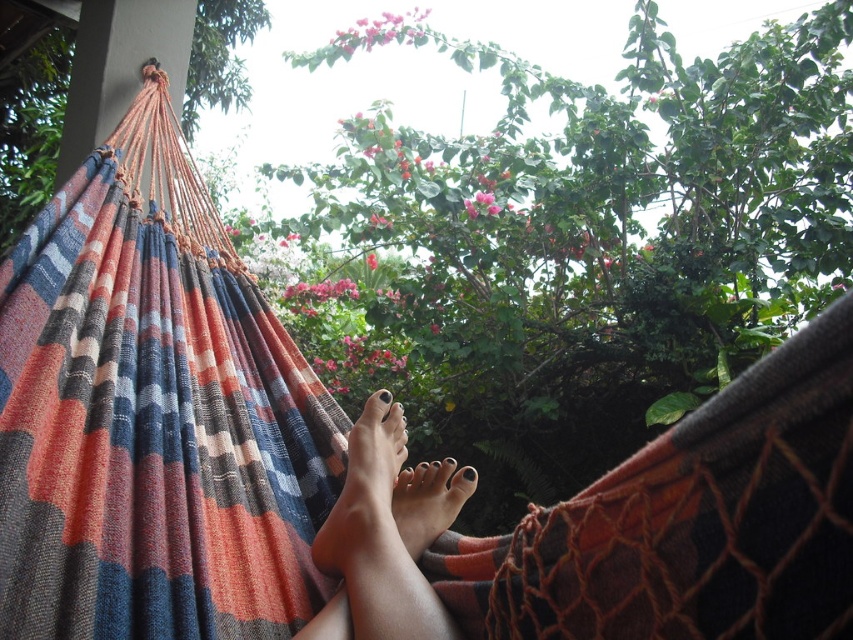
You are a photographer taking a picture of the nail polish toes at center and the smooth skin foot at center. Which object is closer to the camera based on their positions?

The nail polish toes at center is positioned under the smooth skin foot at center, so the smooth skin foot at center is closer to the camera.

You are a photographer taking a picture of the feet in the hammock. You want to focus on the nail polish toes at center and the smooth skin foot at center. Which of these two objects is closer to the camera?

The nail polish toes at center is closer to the viewer than the smooth skin foot at center, so the photographer should focus on the nail polish toes at center as it is nearer to the camera.

From the picture: You are a photographer taking a photo from above. You want to capture the nail polish toes at center clearly. What is the minimum distance you should maintain between your camera and the toes to ensure they are in focus?

The minimum distance you should maintain between your camera and the nail polish toes at center is 35.61 inches to ensure they are in focus.